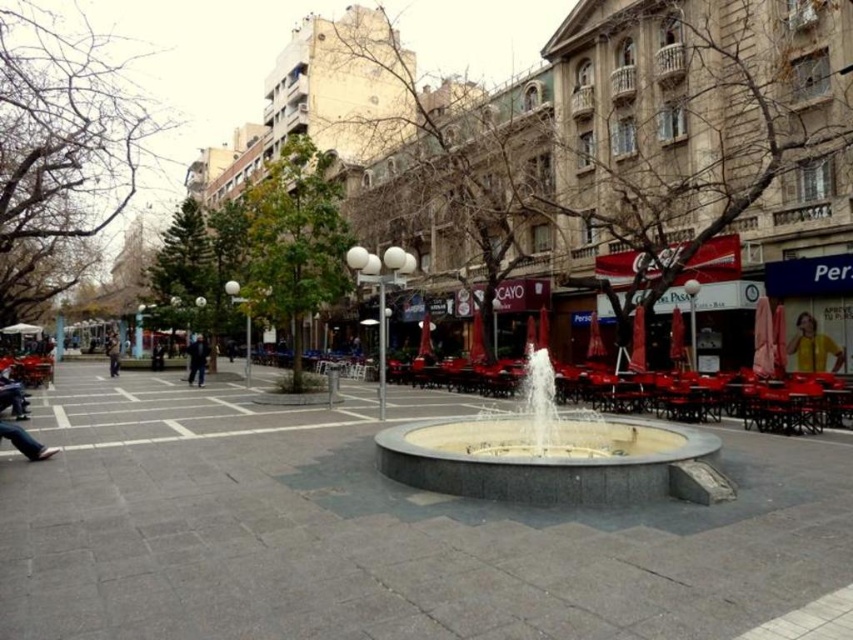
Question: Which object is farther from the camera taking this photo?

Choices:
 (A) dark blue jacket at center
 (B) yellow fabric person at lower right
 (C) smooth concrete fountain at center

Answer: (A)

Question: Considering the real-world distances, which object is closest to the white marble fountain at center?

Choices:
 (A) smooth concrete fountain at center
 (B) dark blue jacket at center

Answer: (A)

Question: Which point appears farthest from the camera in this image?

Choices:
 (A) (462, 433)
 (B) (189, 371)

Answer: (B)

Question: Does yellow fabric person at lower right appear on the left side of dark blue jacket at center?

Choices:
 (A) no
 (B) yes

Answer: (A)

Question: Is yellow fabric person at lower right positioned before dark blue jeans at left?

Choices:
 (A) yes
 (B) no

Answer: (A)

Question: Is smooth concrete fountain at center above dark blue jacket at center?

Choices:
 (A) yes
 (B) no

Answer: (B)